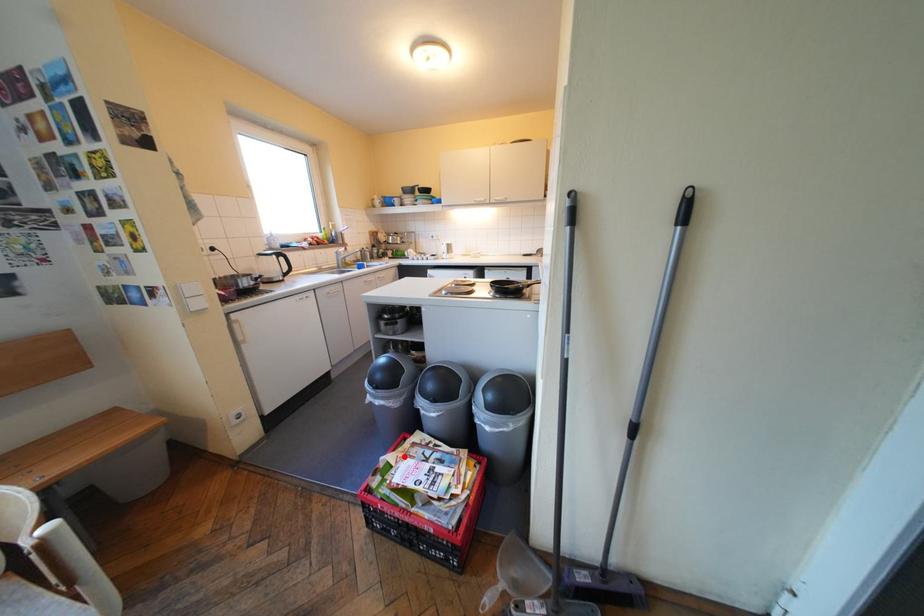
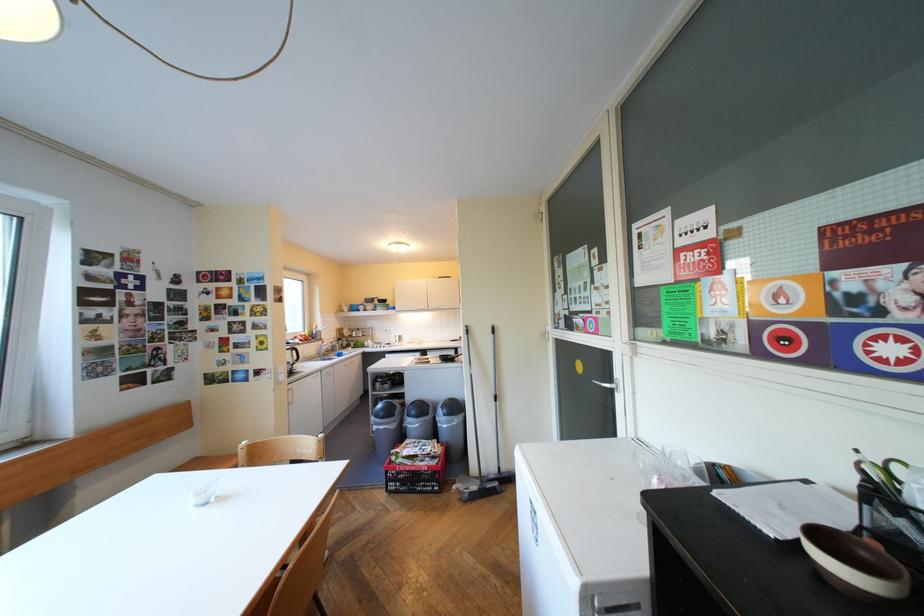
Question: I am providing you with two images of the same scene from different viewpoints. Image1 has a red point marked. In image2, the corresponding 3D location appears at what relative position? Reply with the corresponding letter.

Choices:
 (A) Closer
 (B) Farther

Answer: (B)